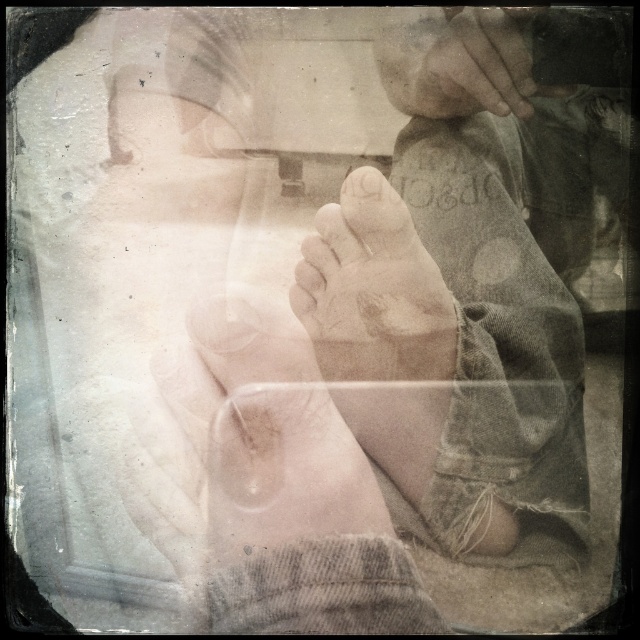
Question: Does smooth skin foot at center come behind smooth skin toe at center?

Choices:
 (A) no
 (B) yes

Answer: (B)

Question: Which point appears farthest from the camera in this image?

Choices:
 (A) coord(356,188)
 (B) coord(468,38)
 (C) coord(337,262)
 (D) coord(304,531)

Answer: (C)

Question: Does smooth skin hand at upper center have a larger size compared to smooth skin toe at center?

Choices:
 (A) yes
 (B) no

Answer: (A)

Question: In this image, where is smooth skin foot at center located relative to smooth skin hand at upper center?

Choices:
 (A) below
 (B) above

Answer: (A)

Question: Which point is farther from the camera taking this photo?

Choices:
 (A) (371, 294)
 (B) (406, 84)
 (C) (262, 333)

Answer: (C)

Question: Which point is farther from the camera taking this photo?

Choices:
 (A) (228, 412)
 (B) (344, 182)
 (C) (380, 42)

Answer: (A)